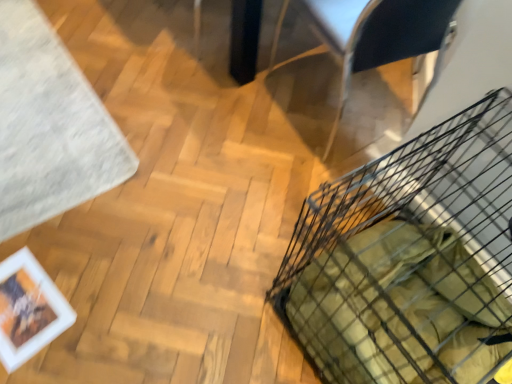
Image resolution: width=512 pixels, height=384 pixels. Identify the location of vacant area that lies between black wire basket at lower right and white matte picture frame at lower left. (169, 301).